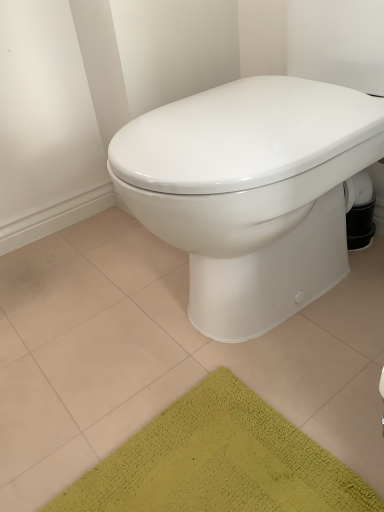
Image resolution: width=384 pixels, height=512 pixels. What are the coordinates of `vacant point to the left of white glossy toilet at center` in the screenshot? It's located at (114, 309).